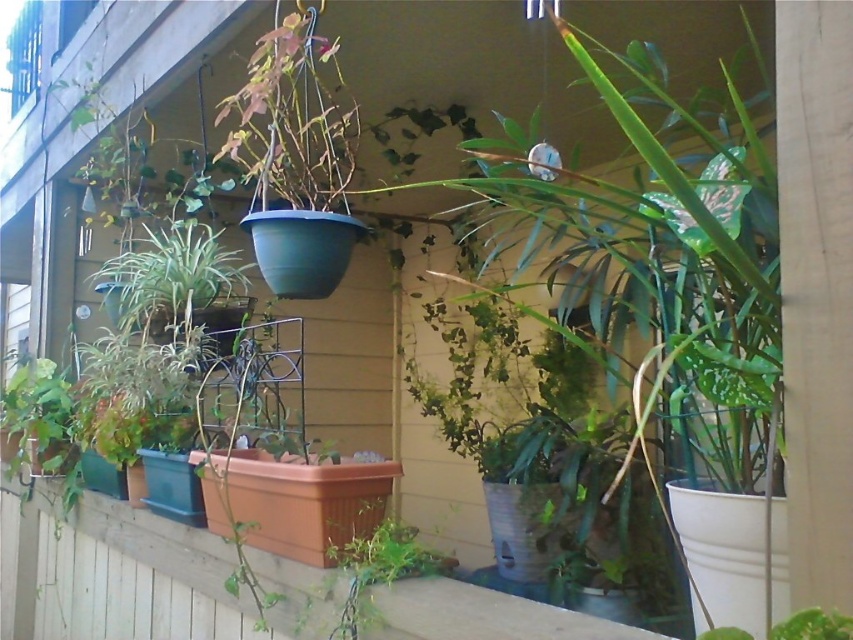
You are standing on the balcony and want to water the plants. You notice the green matte hanging planter at upper center and the green matte plant at left. Which one is positioned to the right side of the other?

The green matte hanging planter at upper center is to the right of the green matte plant at left.

You are designing a layout for a balcony garden and need to ensure that the terracotta plastic window box at center and the green leafy plant at lower center do not block the view from the window. Based on their heights, which object would be more likely to obstruct the view?

The terracotta plastic window box at center is taller than the green leafy plant at lower center, so it would be more likely to obstruct the view from the window.

You are standing on the balcony and want to water the green matte plant at left. If your watering can has a maximum reach of 1.5 meters, can you water it without moving closer?

The green matte plant at left is 1.56 meters away from the viewer, which is slightly beyond the watering can reach of 1.5 meters. Therefore, you need to move closer to reach it.